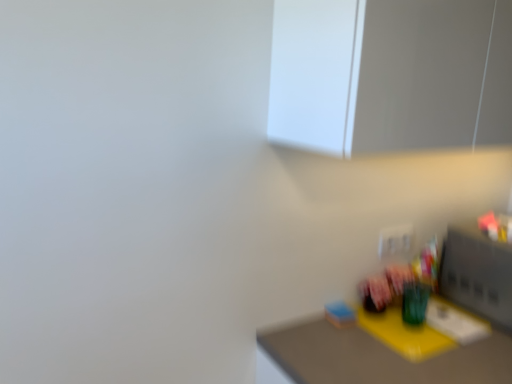
Measure the distance between white glossy medicine cabinet at upper center and camera.

white glossy medicine cabinet at upper center is 31.18 inches away from camera.

The height and width of the screenshot is (384, 512). Identify the location of white glossy medicine cabinet at upper center. (390, 74).

What do you see at coordinates (390, 74) in the screenshot? The height and width of the screenshot is (384, 512). I see `white glossy medicine cabinet at upper center` at bounding box center [390, 74].

You are a GUI agent. You are given a task and a screenshot of the screen. Output one action in this format:
    pyautogui.click(x=<x>, y=<y>)
    Task: Click on the yellow matte table at lower right
    Image resolution: width=512 pixels, height=384 pixels.
    Given the screenshot: What is the action you would take?
    pyautogui.click(x=381, y=354)

What do you see at coordinates (381, 354) in the screenshot? The width and height of the screenshot is (512, 384). I see `yellow matte table at lower right` at bounding box center [381, 354].

You are a GUI agent. You are given a task and a screenshot of the screen. Output one action in this format:
    pyautogui.click(x=<x>, y=<y>)
    Task: Click on the white glossy medicine cabinet at upper center
    Image resolution: width=512 pixels, height=384 pixels.
    Given the screenshot: What is the action you would take?
    pyautogui.click(x=390, y=74)

Which object is positioned more to the left, yellow matte table at lower right or white glossy medicine cabinet at upper center?

white glossy medicine cabinet at upper center is more to the left.

Which object is closer to the camera taking this photo, yellow matte table at lower right or white glossy medicine cabinet at upper center?

white glossy medicine cabinet at upper center is more forward.

Considering the points (335, 368) and (280, 34), which point is behind, point (335, 368) or point (280, 34)?

The point (335, 368) is more distant.

From the image's perspective, between yellow matte table at lower right and white glossy medicine cabinet at upper center, which one is located above?

white glossy medicine cabinet at upper center appears higher in the image.

From a real-world perspective, which is physically below, yellow matte table at lower right or white glossy medicine cabinet at upper center?

In real-world perspective, yellow matte table at lower right is lower.

Considering the sizes of objects yellow matte table at lower right and white glossy medicine cabinet at upper center in the image provided, who is wider, yellow matte table at lower right or white glossy medicine cabinet at upper center?

yellow matte table at lower right is wider.

Can you confirm if yellow matte table at lower right is shorter than white glossy medicine cabinet at upper center?

Incorrect, the height of yellow matte table at lower right does not fall short of that of white glossy medicine cabinet at upper center.

Can you confirm if yellow matte table at lower right is bigger than white glossy medicine cabinet at upper center?

Correct, yellow matte table at lower right is larger in size than white glossy medicine cabinet at upper center.

Choose the correct answer: Is yellow matte table at lower right inside white glossy medicine cabinet at upper center or outside it?

yellow matte table at lower right exists outside the volume of white glossy medicine cabinet at upper center.

Is yellow matte table at lower right beside white glossy medicine cabinet at upper center?

No, yellow matte table at lower right is not in contact with white glossy medicine cabinet at upper center.

Is yellow matte table at lower right facing towards white glossy medicine cabinet at upper center?

No.

Where is `table on the right of white glossy medicine cabinet at upper center`? The width and height of the screenshot is (512, 384). table on the right of white glossy medicine cabinet at upper center is located at coordinates coord(381,354).

Looking at this image, considering the positions of objects white glossy medicine cabinet at upper center and yellow matte table at lower right in the image provided, who is more to the left, white glossy medicine cabinet at upper center or yellow matte table at lower right?

From the viewer's perspective, white glossy medicine cabinet at upper center appears more on the left side.

Which object is closer to the camera taking this photo, white glossy medicine cabinet at upper center or yellow matte table at lower right?

Positioned in front is white glossy medicine cabinet at upper center.

Considering the positions of points (451, 136) and (345, 348), is point (451, 136) farther from camera compared to point (345, 348)?

No, (451, 136) is closer to viewer.

From the image's perspective, is white glossy medicine cabinet at upper center located above yellow matte table at lower right?

Yes, from the image's perspective, white glossy medicine cabinet at upper center is over yellow matte table at lower right.

Consider the image. From a real-world perspective, does white glossy medicine cabinet at upper center stand above yellow matte table at lower right?

Yes, from a real-world perspective, white glossy medicine cabinet at upper center is on top of yellow matte table at lower right.

Which object is wider, white glossy medicine cabinet at upper center or yellow matte table at lower right?

yellow matte table at lower right.

Does white glossy medicine cabinet at upper center have a greater height compared to yellow matte table at lower right?

No.

Who is bigger, white glossy medicine cabinet at upper center or yellow matte table at lower right?

With larger size is yellow matte table at lower right.

Is yellow matte table at lower right completely or partially inside white glossy medicine cabinet at upper center?

Definitely not — yellow matte table at lower right is not inside white glossy medicine cabinet at upper center.

Looking at this image, is white glossy medicine cabinet at upper center positioned far away from yellow matte table at lower right?

No, there isn't a large distance between white glossy medicine cabinet at upper center and yellow matte table at lower right.

Is white glossy medicine cabinet at upper center turned away from yellow matte table at lower right?

No, white glossy medicine cabinet at upper center's orientation is not away from yellow matte table at lower right.

Where is `table on the right of white glossy medicine cabinet at upper center`? table on the right of white glossy medicine cabinet at upper center is located at coordinates (381, 354).

Find the location of a particular element. table located on the right of white glossy medicine cabinet at upper center is located at coordinates (381, 354).

You are a GUI agent. You are given a task and a screenshot of the screen. Output one action in this format:
    pyautogui.click(x=<x>, y=<y>)
    Task: Click on the medicine cabinet above the yellow matte table at lower right (from a real-world perspective)
    The image size is (512, 384).
    Given the screenshot: What is the action you would take?
    pyautogui.click(x=390, y=74)